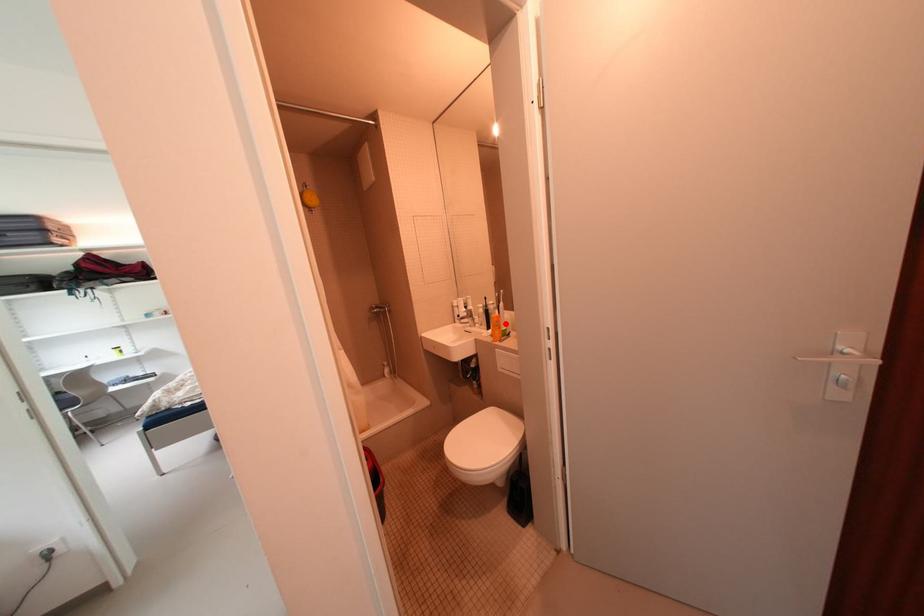
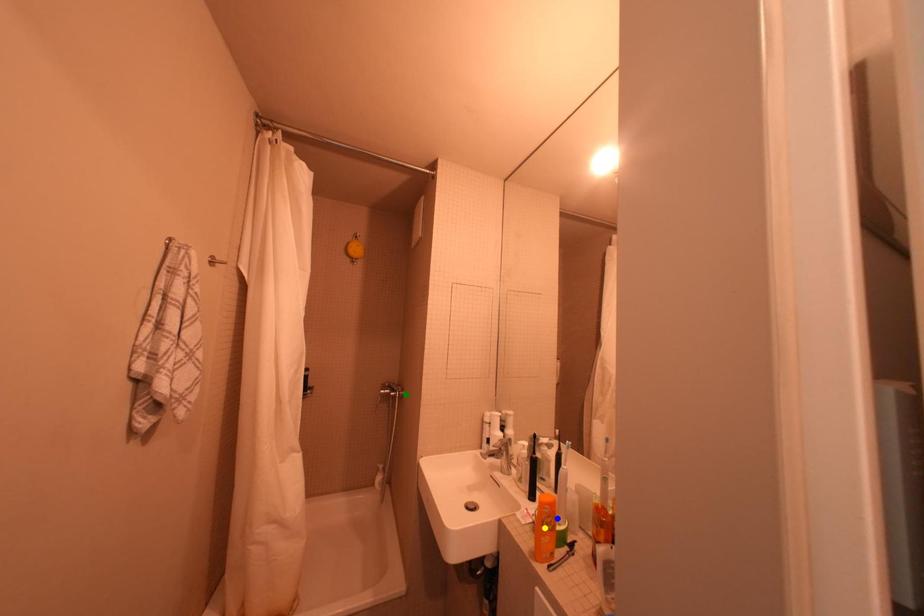
Question: I am providing you with two images of the same scene from different viewpoints. A red point is marked on the first image. You are given multiple points on the second image. Which mark in image 2 goes with the point in image 1?

Choices:
 (A) yellow point
 (B) blue point
 (C) green point

Answer: (B)